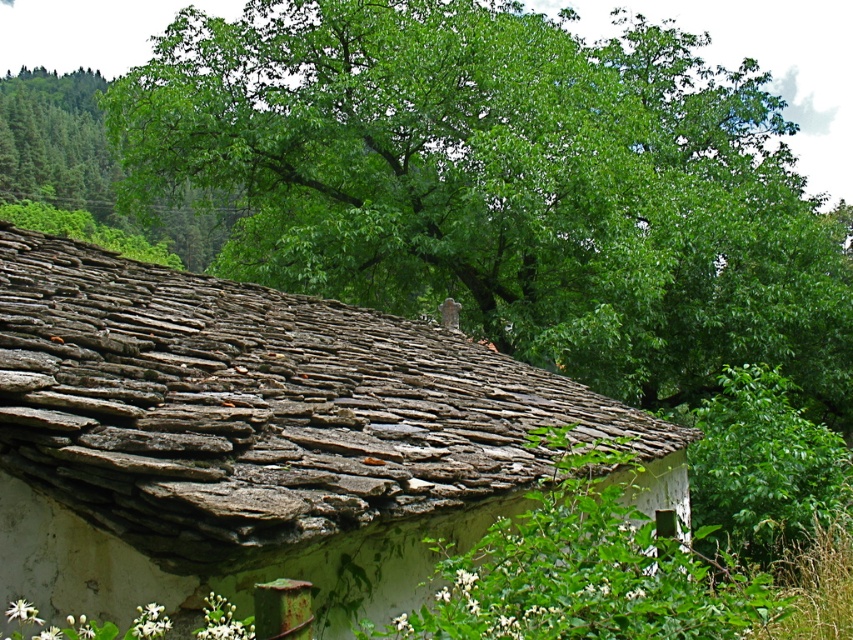
Who is higher up, green leafy tree at upper center or rusty slate roof at center?

green leafy tree at upper center

Is green leafy tree at upper center closer to camera compared to rusty slate roof at center?

No, green leafy tree at upper center is behind rusty slate roof at center.

Is point (508, 259) closer to viewer compared to point (247, 344)?

No, (508, 259) is behind (247, 344).

Image resolution: width=853 pixels, height=640 pixels. I want to click on green leafy tree at upper center, so click(505, 186).